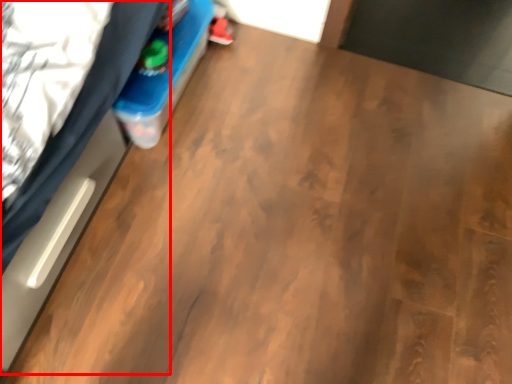
Question: From the image's perspective, what is the correct spatial positioning of bed (annotated by the red box) in reference to footwear?

Choices:
 (A) below
 (B) above

Answer: (A)